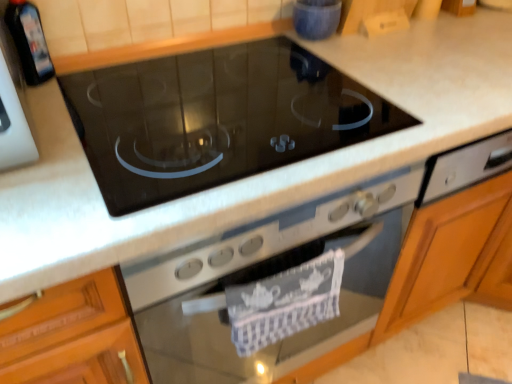
Question: Does black glass cooktop at center have a greater height compared to black glass bottle at upper left, which is the 2th appliance from right to left?

Choices:
 (A) yes
 (B) no

Answer: (A)

Question: Is black glass cooktop at center at the right side of black glass bottle at upper left, the first appliance from the left?

Choices:
 (A) no
 (B) yes

Answer: (B)

Question: Is black glass cooktop at center not inside black glass bottle at upper left, the first appliance from the left?

Choices:
 (A) no
 (B) yes

Answer: (B)

Question: Is black glass cooktop at center positioned with its back to black glass bottle at upper left, the first appliance from the left?

Choices:
 (A) no
 (B) yes

Answer: (A)

Question: From a real-world perspective, is black glass cooktop at center located higher than black glass bottle at upper left, the first appliance from the left?

Choices:
 (A) no
 (B) yes

Answer: (A)

Question: Does black glass cooktop at center appear on the left side of black glass bottle at upper left, the first appliance viewed from the front?

Choices:
 (A) yes
 (B) no

Answer: (B)

Question: Is black glass cooktop at center positioned in front of black glass cooktop at center?

Choices:
 (A) no
 (B) yes

Answer: (B)

Question: Considering the relative sizes of black glass cooktop at center and black glass cooktop at center in the image provided, is black glass cooktop at center taller than black glass cooktop at center?

Choices:
 (A) yes
 (B) no

Answer: (B)

Question: From a real-world perspective, is black glass cooktop at center positioned over black glass cooktop at center based on gravity?

Choices:
 (A) no
 (B) yes

Answer: (B)

Question: Is the depth of black glass cooktop at center greater than that of black glass cooktop at center?

Choices:
 (A) yes
 (B) no

Answer: (B)

Question: Are black glass cooktop at center and black glass cooktop at center far apart?

Choices:
 (A) no
 (B) yes

Answer: (A)

Question: Considering the relative positions of black glass cooktop at center and black glass cooktop at center in the image provided, is black glass cooktop at center to the right of black glass cooktop at center from the viewer's perspective?

Choices:
 (A) yes
 (B) no

Answer: (B)

Question: From the image's perspective, is black glass cooktop at center beneath black glass bottle at upper left, the first appliance from the left?

Choices:
 (A) yes
 (B) no

Answer: (A)